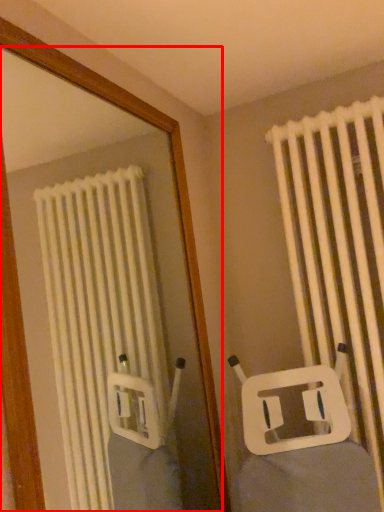
Question: In this image, where is mirror (annotated by the red box) located relative to curtain?

Choices:
 (A) left
 (B) right

Answer: (A)